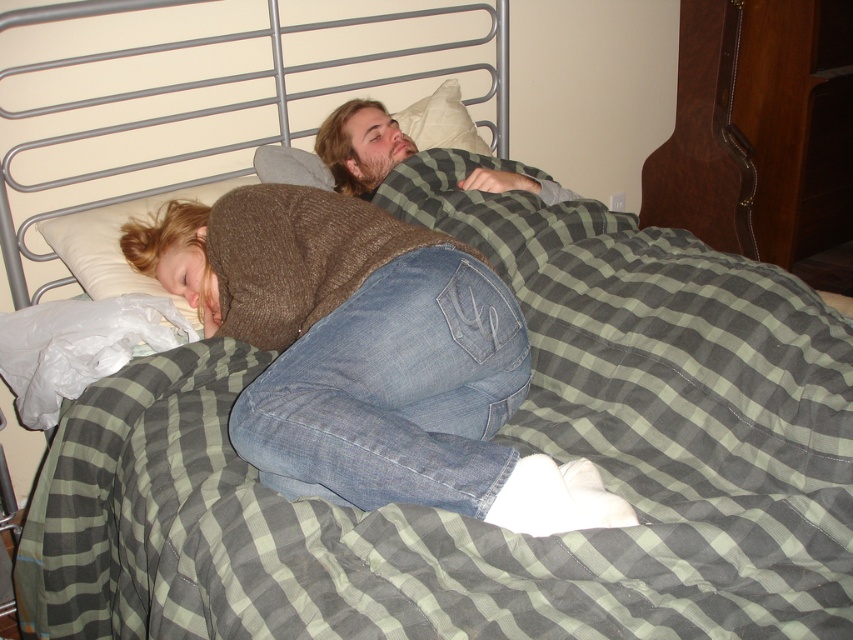
You are a photographer trying to capture a closeup of the bearded man at center without moving the white soft pillow at upper center. Since the pillow is in the way, can you still take the photo?

The bearded man at center is taller than the white soft pillow at upper center, so yes, you can take the closeup photo of the bearded man at center without moving the pillow as the man is taller and likely not fully obscured by the pillow.

You are standing in the room and want to reach the point marked as point (x=271, y=257). If you can stretch your arm 1.2 meters, can you reach it without moving your feet?

The point (x=271, y=257) is 1.26 meters from the camera. Since your arm can only stretch 1.2 meters, you cannot reach it without moving your feet.